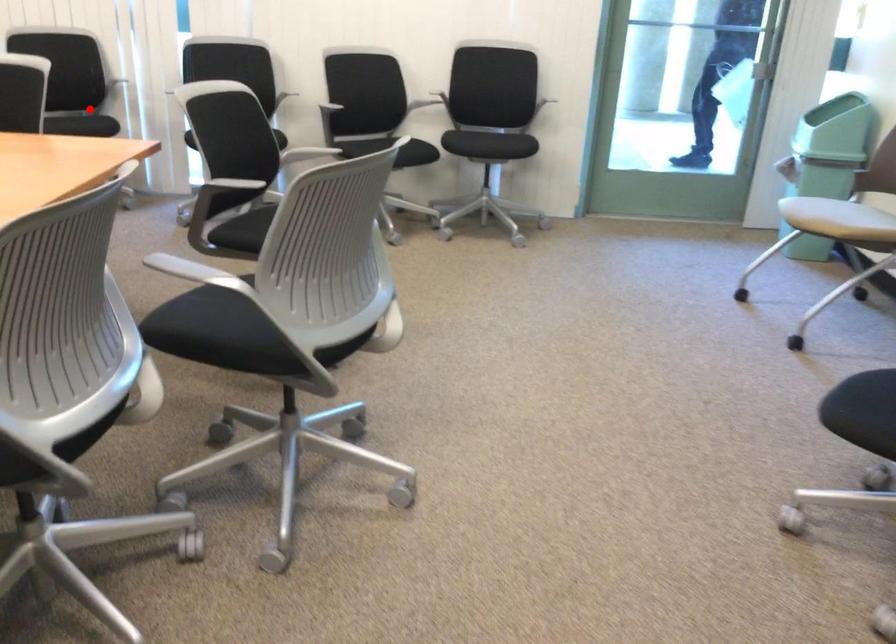
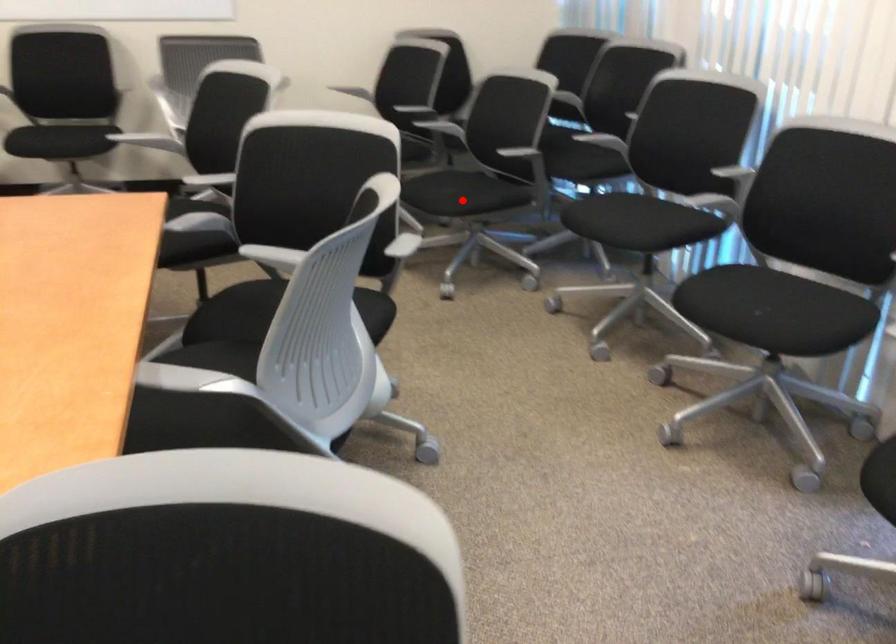
I am providing you with two images of the same scene from different viewpoints. A red point is marked on the first image and another point is marked on the second image. Do the highlighted points in image1 and image2 indicate the same real-world spot?

No